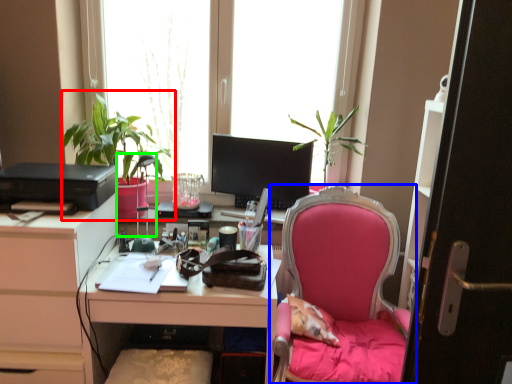
Question: Which is farther away from houseplant (highlighted by a red box)? chair (highlighted by a blue box) or lamp (highlighted by a green box)?

Choices:
 (A) chair
 (B) lamp

Answer: (A)